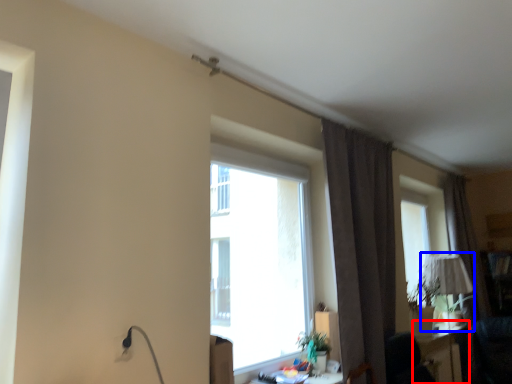
Question: Which object appears closest to the camera in this image, table (highlighted by a red box) or table lamp (highlighted by a blue box)?

Choices:
 (A) table
 (B) table lamp

Answer: (A)